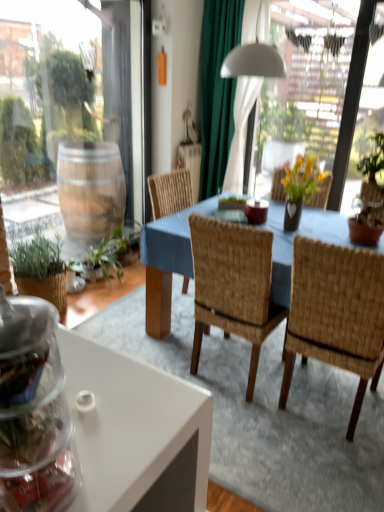
Find the location of a particular element. The image size is (384, 512). free space in front of woven wood chair at center, which is the 1th chair from left to right is located at coordinates (260, 436).